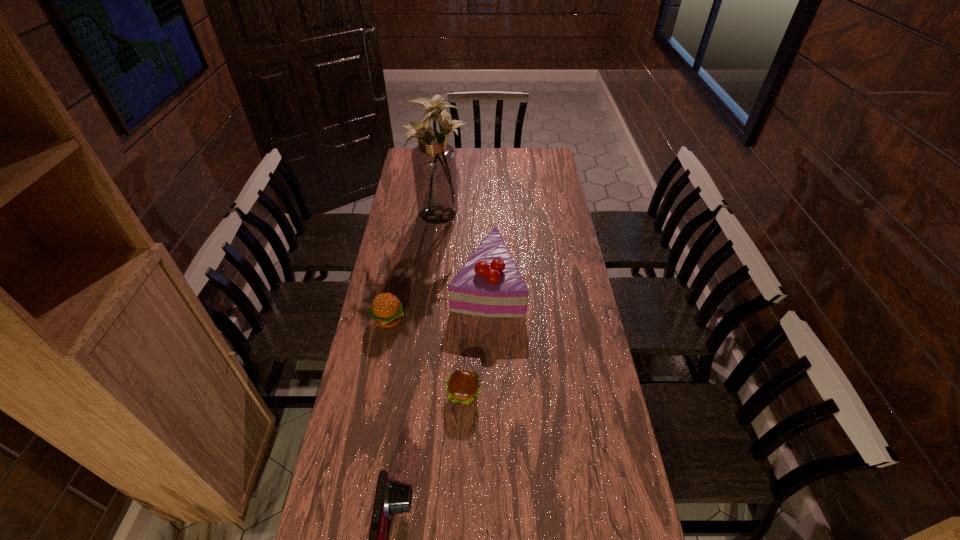
Locate an element on the screen. Image resolution: width=960 pixels, height=540 pixels. flower arrangement is located at coordinates (434, 160).

At what (x,y) coordinates should I click in order to perform the action: click on the tallest object. Please return your answer as a coordinate pair (x, y). This screenshot has height=540, width=960. Looking at the image, I should click on (434, 160).

At what (x,y) coordinates should I click in order to perform the action: click on cake. Please return your answer as a coordinate pair (x, y). Looking at the image, I should click on (489, 284).

Image resolution: width=960 pixels, height=540 pixels. I want to click on the farther hamburger, so click(387, 310).

Locate an element on the screen. The image size is (960, 540). the left hamburger is located at coordinates (387, 310).

This screenshot has width=960, height=540. In order to click on the nearer hamburger in this screenshot , I will do `click(462, 386)`.

Find the location of `the shortest object`. the shortest object is located at coordinates (462, 386).

Find the location of a particular element. Image resolution: width=960 pixels, height=540 pixels. vacant region located on the right of the tallest object is located at coordinates (513, 212).

The image size is (960, 540). What are the coordinates of `vacant space situated 0.120m on the right of the cake` in the screenshot? It's located at (554, 282).

You are a GUI agent. You are given a task and a screenshot of the screen. Output one action in this format:
    pyautogui.click(x=<x>, y=<y>)
    Task: Click on the vacant region located 0.290m on the front of the left hamburger
    This screenshot has height=540, width=960.
    Given the screenshot: What is the action you would take?
    pyautogui.click(x=372, y=410)